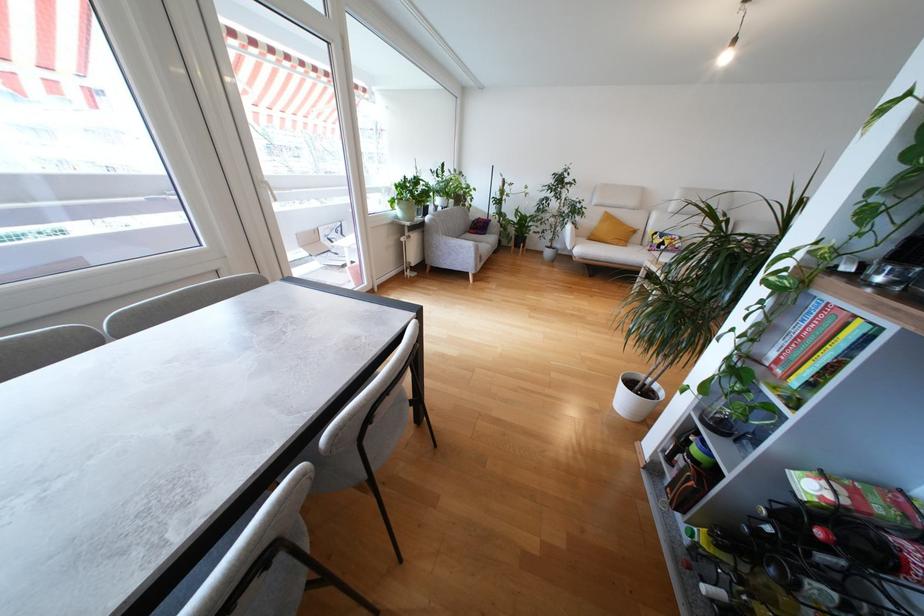
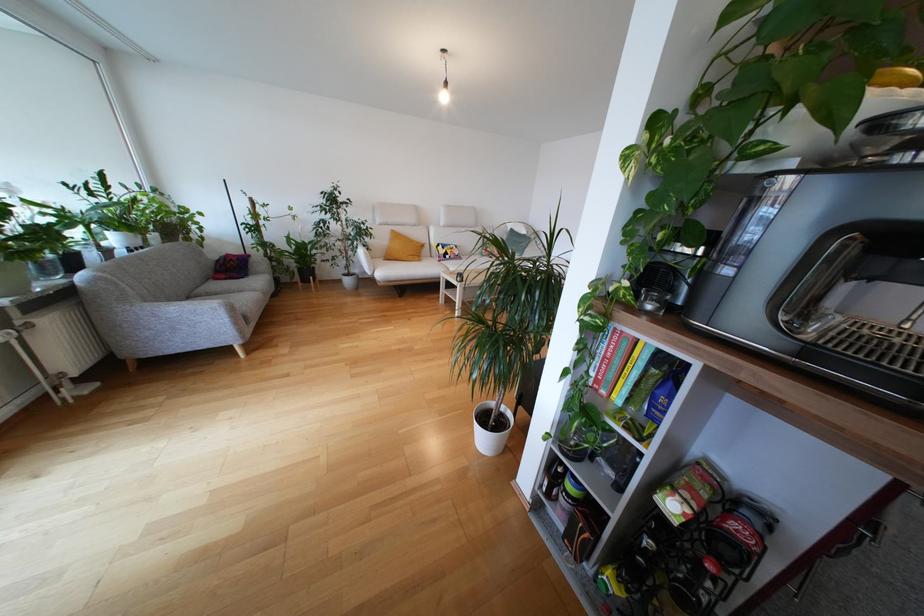
The point at (x=492, y=230) is marked in the first image. Where is the corresponding point in the second image?

(253, 268)